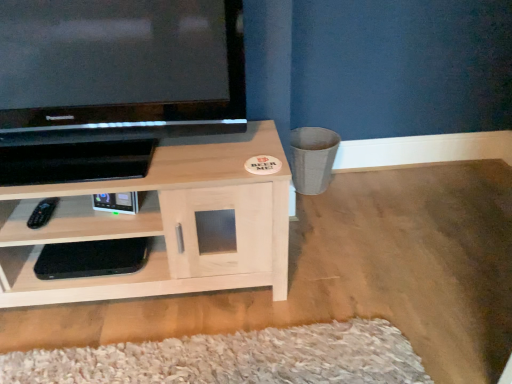
Find the location of `vacant area that is situated to the right of light wood/woodenobject at lower left, the 1th shelf from the top`. vacant area that is situated to the right of light wood/woodenobject at lower left, the 1th shelf from the top is located at coordinates (352, 270).